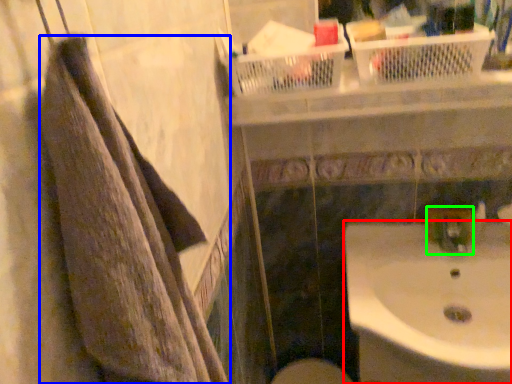
Question: Which is nearer to the sink (highlighted by a red box)? towel (highlighted by a blue box) or plumbing fixture (highlighted by a green box).

Choices:
 (A) towel
 (B) plumbing fixture

Answer: (B)